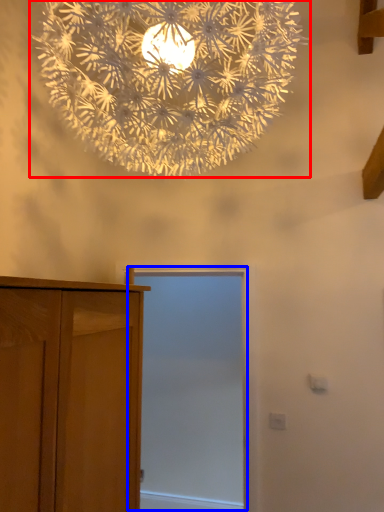
Question: Which object appears closest to the camera in this image, lamp (highlighted by a red box) or screen door (highlighted by a blue box)?

Choices:
 (A) lamp
 (B) screen door

Answer: (A)